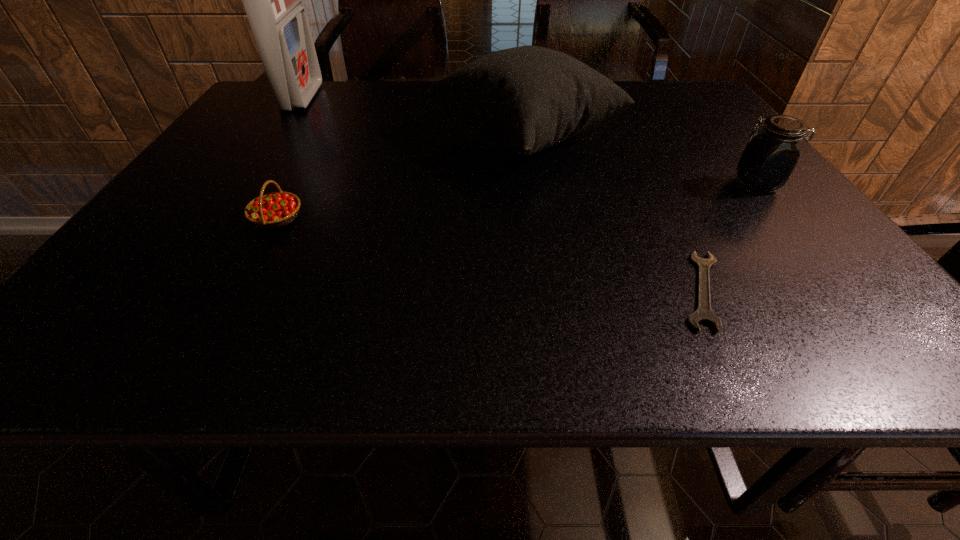
The width and height of the screenshot is (960, 540). I want to click on free location located 0.240m on the right of the cushion, so tap(717, 136).

Find the location of a particular element. vacant space located on the lid of the jar is located at coordinates (691, 184).

Identify the location of vacant space located 0.330m on the lid of the jar. (582, 184).

Where is `free space located 0.160m on the lid of the jar`? Image resolution: width=960 pixels, height=540 pixels. free space located 0.160m on the lid of the jar is located at coordinates (660, 184).

The width and height of the screenshot is (960, 540). I want to click on vacant area situated 0.260m on the back of the second object from left to right, so click(318, 142).

Locate an element on the screen. The width and height of the screenshot is (960, 540). free space located on the back of the nearest object is located at coordinates (663, 211).

You are a GUI agent. You are given a task and a screenshot of the screen. Output one action in this format:
    pyautogui.click(x=<x>, y=<y>)
    Task: Click on the first-aid kit located at the far edge
    This screenshot has width=960, height=540.
    Given the screenshot: What is the action you would take?
    pyautogui.click(x=272, y=0)

This screenshot has height=540, width=960. I want to click on cushion at the far edge, so click(527, 98).

The width and height of the screenshot is (960, 540). I want to click on object that is at the near edge, so click(x=703, y=313).

What are the coordinates of `object that is at the left edge` in the screenshot? It's located at (272, 0).